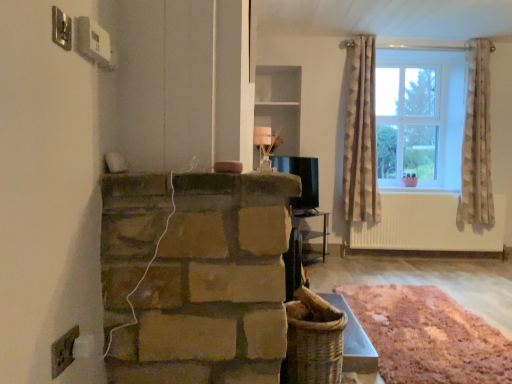
Locate an element on the screen. beige textured curtain at upper right is located at coordinates (361, 135).

Looking at this image, measure the distance between point (x=362, y=138) and camera.

They are 14.29 feet apart.

What do you see at coordinates (361, 135) in the screenshot? Image resolution: width=512 pixels, height=384 pixels. I see `beige textured curtain at upper right` at bounding box center [361, 135].

This screenshot has height=384, width=512. What are the coordinates of `beige textured curtain at upper right` in the screenshot? It's located at (361, 135).